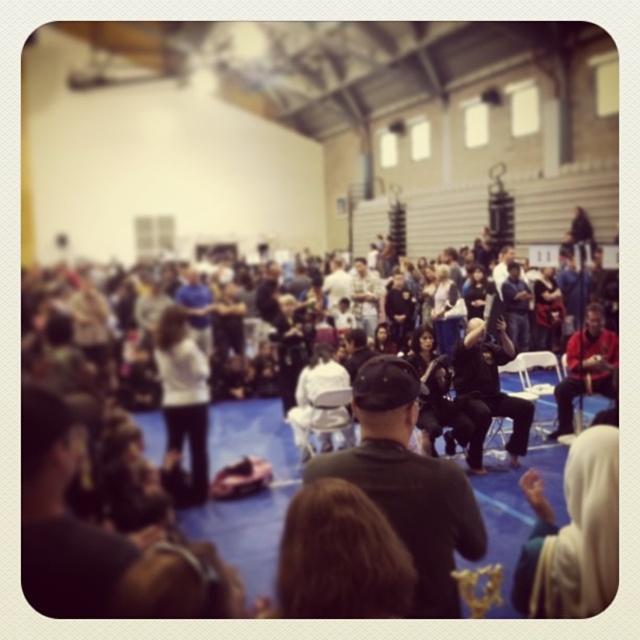
Question: Observing the image, what is the correct spatial positioning of matte black jacket at center in reference to white fabric at lower right?

Choices:
 (A) below
 (B) above

Answer: (B)

Question: From the image, what is the correct spatial relationship of matte black jacket at center in relation to reddish-brown leather jacket at right?

Choices:
 (A) left
 (B) right

Answer: (A)

Question: Which object appears farthest from the camera in this image?

Choices:
 (A) white fabric at lower right
 (B) black matte jacket at center
 (C) matte black jacket at center

Answer: (B)

Question: Can you confirm if black leather jacket at center is positioned below matte black cap at lower left?

Choices:
 (A) no
 (B) yes

Answer: (B)

Question: Among these points, which one is farthest from the camera?

Choices:
 (A) (49, 440)
 (B) (470, 454)
 (C) (378, 436)
 (D) (436, 504)

Answer: (B)

Question: Which point appears farthest from the camera in this image?

Choices:
 (A) (506, 403)
 (B) (100, 561)
 (C) (566, 412)

Answer: (C)